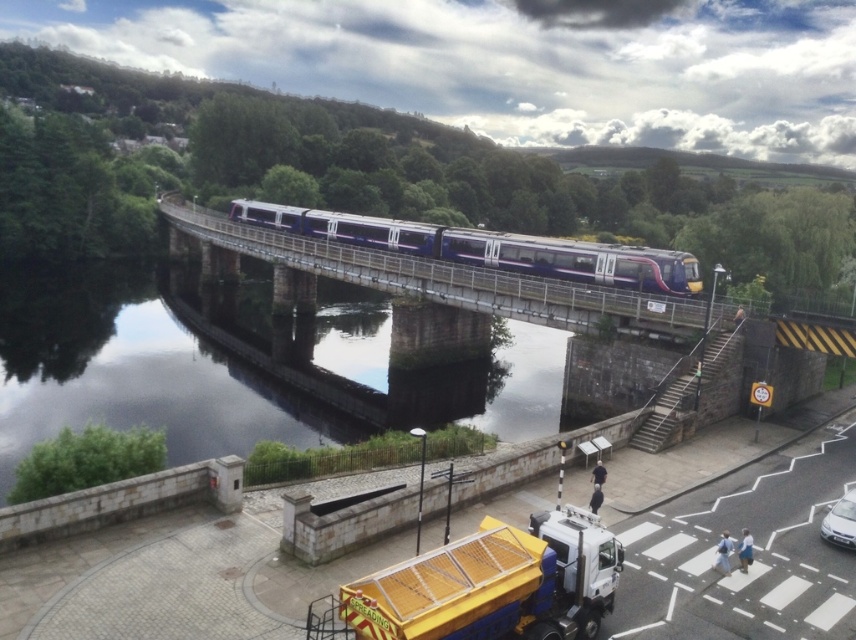
Question: Which object appears farthest from the camera in this image?

Choices:
 (A) silver metallic car at lower right
 (B) dark reflective water at center

Answer: (B)

Question: Which object is positioned closest to the dark reflective water at center?

Choices:
 (A) yellow mesh truck at lower center
 (B) silver metallic car at lower right

Answer: (B)

Question: Considering the relative positions of dark reflective water at center and purple glossy train at center in the image provided, where is dark reflective water at center located with respect to purple glossy train at center?

Choices:
 (A) left
 (B) right

Answer: (A)

Question: Which object appears closest to the camera in this image?

Choices:
 (A) silver metallic car at lower right
 (B) yellow mesh truck at lower center
 (C) purple glossy train at center

Answer: (B)

Question: From the image, what is the correct spatial relationship of yellow mesh truck at lower center in relation to purple glossy train at center?

Choices:
 (A) left
 (B) right

Answer: (B)

Question: From the image, what is the correct spatial relationship of dark reflective water at center in relation to silver metallic car at lower right?

Choices:
 (A) above
 (B) below

Answer: (A)